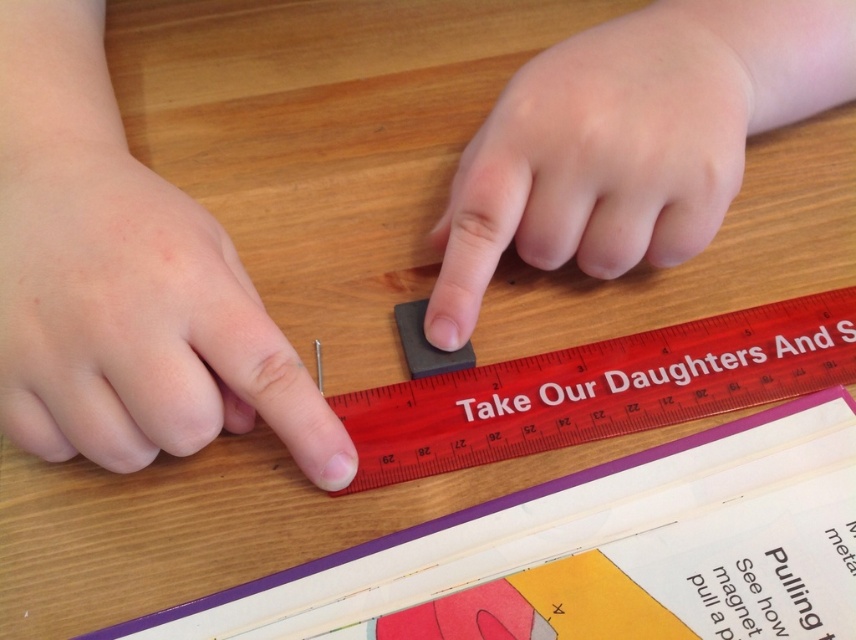
Who is more forward, (584, 100) or (599, 417)?

Point (584, 100)

Does point (667, 241) come in front of point (735, 324)?

That is True.

What are the coordinates of `smooth skin hand at center` in the screenshot? It's located at (602, 154).

Who is lower down, smooth skin hand at center or black rubber ruler at center?

Positioned lower is black rubber ruler at center.

Which is in front, point (559, 74) or point (424, 339)?

Point (559, 74) is more forward.

Who is more forward, (x=617, y=77) or (x=401, y=307)?

Positioned in front is point (x=617, y=77).

Identify the location of smooth skin hand at center. The image size is (856, 640). (602, 154).

Is smooth skin finger at center above smooth skin hand at center?

No.

Can you confirm if smooth skin finger at center is shorter than smooth skin hand at center?

Yes, smooth skin finger at center is shorter than smooth skin hand at center.

Is point (75, 163) farther from viewer compared to point (741, 150)?

No, (75, 163) is in front of (741, 150).

Identify the location of smooth skin finger at center. (135, 321).